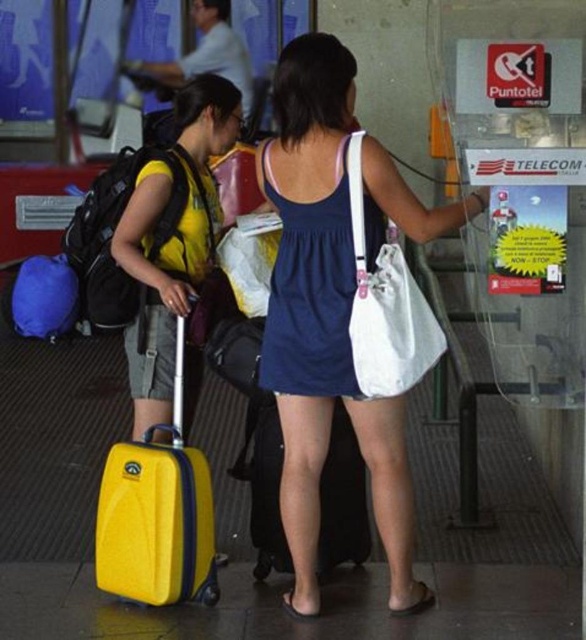
Is yellow matte suitcase at left smaller than yellow matte suitcase at lower left?

No, yellow matte suitcase at left is not smaller than yellow matte suitcase at lower left.

Does yellow matte suitcase at left come in front of yellow matte suitcase at lower left?

No, yellow matte suitcase at left is behind yellow matte suitcase at lower left.

Locate an element on the screen. yellow matte suitcase at left is located at coordinates (172, 241).

At what (x,y) coordinates should I click in order to perform the action: click on yellow matte suitcase at left. Please return your answer as a coordinate pair (x, y). Looking at the image, I should click on (172, 241).

Locate an element on the screen. Image resolution: width=586 pixels, height=640 pixels. white fabric bag at center is located at coordinates (386, 305).

Is white fabric bag at center to the right of yellow hardshell suitcase at lower left from the viewer's perspective?

Correct, you'll find white fabric bag at center to the right of yellow hardshell suitcase at lower left.

At what (x,y) coordinates should I click in order to perform the action: click on white fabric bag at center. Please return your answer as a coordinate pair (x, y). Looking at the image, I should click on (386, 305).

Is yellow matte suitcase at lower left further to camera compared to matte black backpack at left?

No, yellow matte suitcase at lower left is in front of matte black backpack at left.

Which is in front, point (207, 593) or point (77, 236)?

Point (207, 593) is more forward.

Does point (149, 541) come closer to viewer compared to point (66, 257)?

Yes, it is in front of point (66, 257).

This screenshot has height=640, width=586. Identify the location of yellow matte suitcase at lower left. (156, 515).